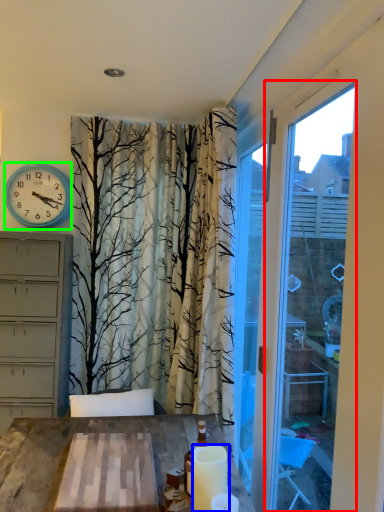
Question: Which object is the farthest from window frame (highlighted by a red box)? Choose among these: candle (highlighted by a blue box) or wall clock (highlighted by a green box).

Choices:
 (A) candle
 (B) wall clock

Answer: (B)